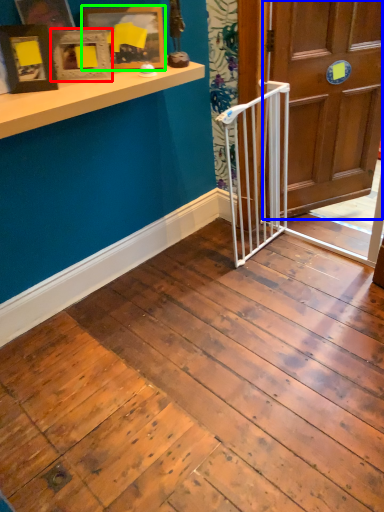
Question: Which is nearer to the picture frame (highlighted by a red box)? door (highlighted by a blue box) or picture frame (highlighted by a green box).

Choices:
 (A) door
 (B) picture frame

Answer: (B)